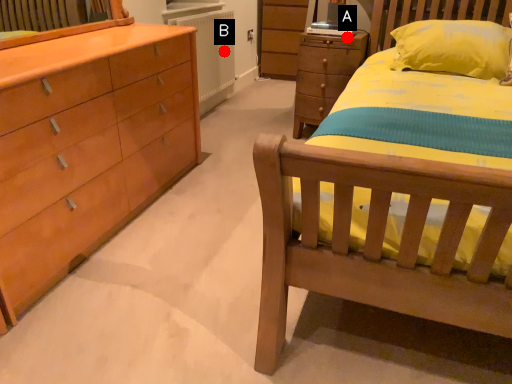
Question: Two points are circled on the image, labeled by A and B beside each circle. Which point appears farthest from the camera in this image?

Choices:
 (A) A is further
 (B) B is further

Answer: (B)